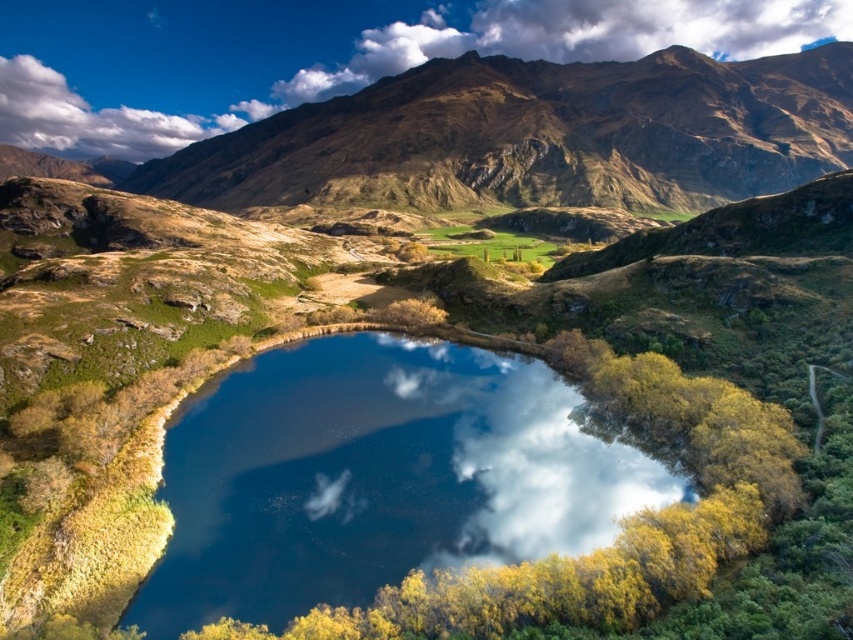
Question: Estimate the real-world distances between objects in this image. Which object is closer to the white fluffy cloud at upper center?

Choices:
 (A) white fluffy cloud at upper left
 (B) glossy blue water at center

Answer: (A)

Question: Which object appears closest to the camera in this image?

Choices:
 (A) white fluffy cloud at upper left
 (B) glossy blue water at center

Answer: (B)

Question: Is glossy blue water at center below white fluffy cloud at upper center?

Choices:
 (A) yes
 (B) no

Answer: (A)

Question: Which object is farther from the camera taking this photo?

Choices:
 (A) white fluffy cloud at upper left
 (B) glossy blue water at center
 (C) white fluffy cloud at upper center

Answer: (A)

Question: Does white fluffy cloud at upper center have a greater width compared to white fluffy cloud at upper left?

Choices:
 (A) no
 (B) yes

Answer: (B)

Question: Can you confirm if glossy blue water at center is wider than white fluffy cloud at upper left?

Choices:
 (A) no
 (B) yes

Answer: (A)